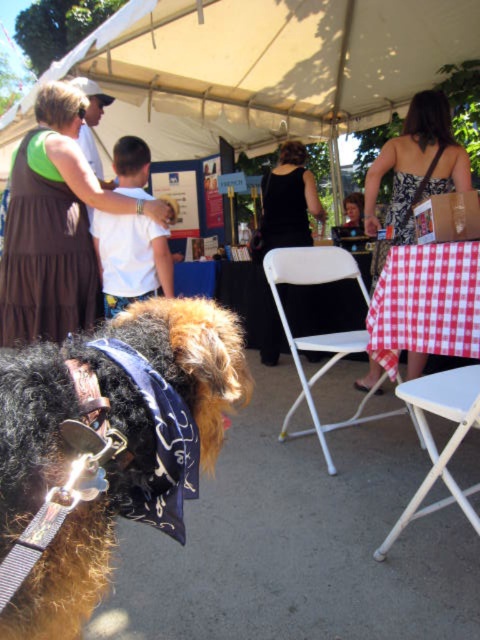
Question: Which of the following is the closest to the observer?

Choices:
 (A) (192, 436)
 (B) (10, 177)
 (C) (288, 211)
 (D) (336, 260)

Answer: (A)

Question: Which point is closer to the camera?

Choices:
 (A) white cotton shirt at center
 (B) smooth brown hair at center

Answer: (A)

Question: Is fuzzy brown dog at lower left bigger than white plastic chair at lower right?

Choices:
 (A) yes
 (B) no

Answer: (B)

Question: Estimate the real-world distances between objects in this image. Which object is closer to the black lace dress at center?

Choices:
 (A) black dress at center
 (B) smooth brown hair at center
 (C) red checkered tablecloth at center right
 (D) fuzzy brown dog at lower left

Answer: (A)

Question: Does white plastic chair at lower right lie in front of red checkered tablecloth at center right?

Choices:
 (A) no
 (B) yes

Answer: (B)

Question: Is fuzzy brown dog at lower left above blue satin neckband at lower left?

Choices:
 (A) no
 (B) yes

Answer: (B)